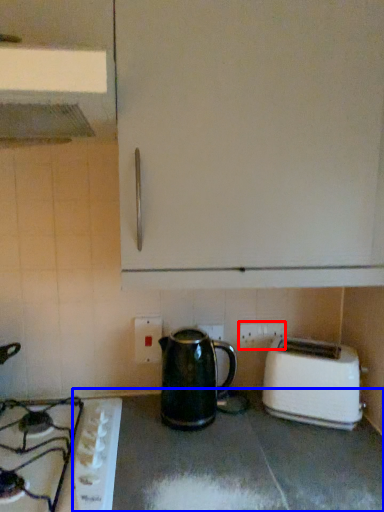
Question: Which point is further to the camera, electric outlet (highlighted by a red box) or counter top (highlighted by a blue box)?

Choices:
 (A) electric outlet
 (B) counter top

Answer: (A)